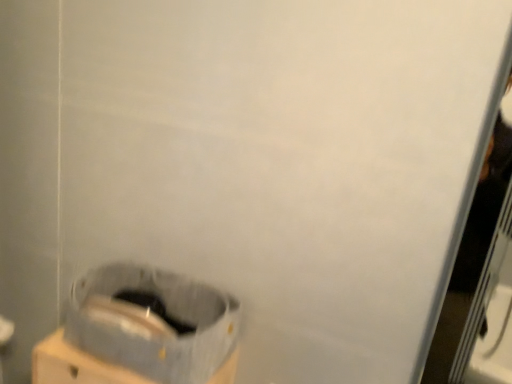
Question: From the image's perspective, is gray fabric waste container at lower left positioned above or below gray fabric bag at lower center?

Choices:
 (A) below
 (B) above

Answer: (B)

Question: From a real-world perspective, relative to gray fabric bag at lower center, is gray fabric waste container at lower left vertically above or below?

Choices:
 (A) above
 (B) below

Answer: (A)

Question: Considering the positions of gray fabric waste container at lower left and gray fabric bag at lower center in the image, is gray fabric waste container at lower left bigger or smaller than gray fabric bag at lower center?

Choices:
 (A) small
 (B) big

Answer: (A)

Question: Is point (125, 372) closer or farther from the camera than point (234, 301)?

Choices:
 (A) farther
 (B) closer

Answer: (B)

Question: In terms of size, does gray fabric bag at lower center appear bigger or smaller than gray fabric waste container at lower left?

Choices:
 (A) small
 (B) big

Answer: (B)

Question: In the image, is gray fabric bag at lower center on the left side or the right side of gray fabric waste container at lower left?

Choices:
 (A) right
 (B) left

Answer: (B)

Question: Is gray fabric bag at lower center spatially inside gray fabric waste container at lower left, or outside of it?

Choices:
 (A) inside
 (B) outside

Answer: (B)